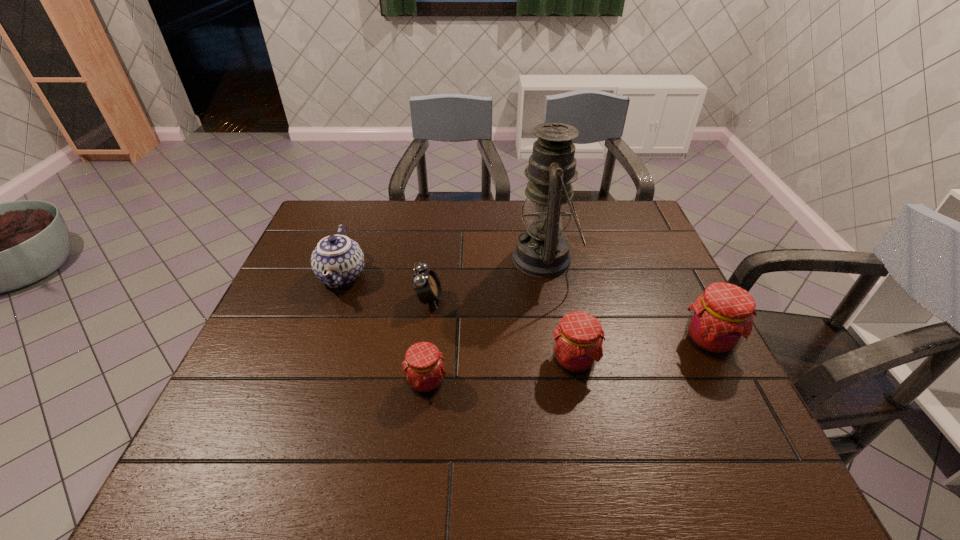
Where is `vacant area at the left edge of the desktop`? The width and height of the screenshot is (960, 540). vacant area at the left edge of the desktop is located at coordinates (296, 355).

This screenshot has width=960, height=540. What are the coordinates of `free space at the right edge` in the screenshot? It's located at (692, 364).

Locate an element on the screen. vacant area at the far right corner of the desktop is located at coordinates (632, 215).

Identify the location of free spot between the shortest jam and the leftmost object. (384, 329).

Find the location of `free area in between the chinaware and the leftmost jam`. free area in between the chinaware and the leftmost jam is located at coordinates (384, 329).

Where is `free space between the rightmost jam and the tallest object`? free space between the rightmost jam and the tallest object is located at coordinates (627, 300).

I want to click on free point between the chinaware and the alarm clock, so click(x=386, y=288).

You are a GUI agent. You are given a task and a screenshot of the screen. Output one action in this format:
    pyautogui.click(x=<x>, y=<y>)
    Task: Click on the free space between the shortest object and the leftmost object
    The image size is (960, 540).
    Given the screenshot: What is the action you would take?
    pyautogui.click(x=384, y=329)

The width and height of the screenshot is (960, 540). What are the coordinates of `vacant space that's between the oil lamp and the shortest jam` in the screenshot? It's located at (486, 321).

You are a GUI agent. You are given a task and a screenshot of the screen. Output one action in this format:
    pyautogui.click(x=<x>, y=<y>)
    Task: Click on the vacant region between the tallest object and the second shortest jam
    
    Given the screenshot: What is the action you would take?
    pyautogui.click(x=560, y=310)